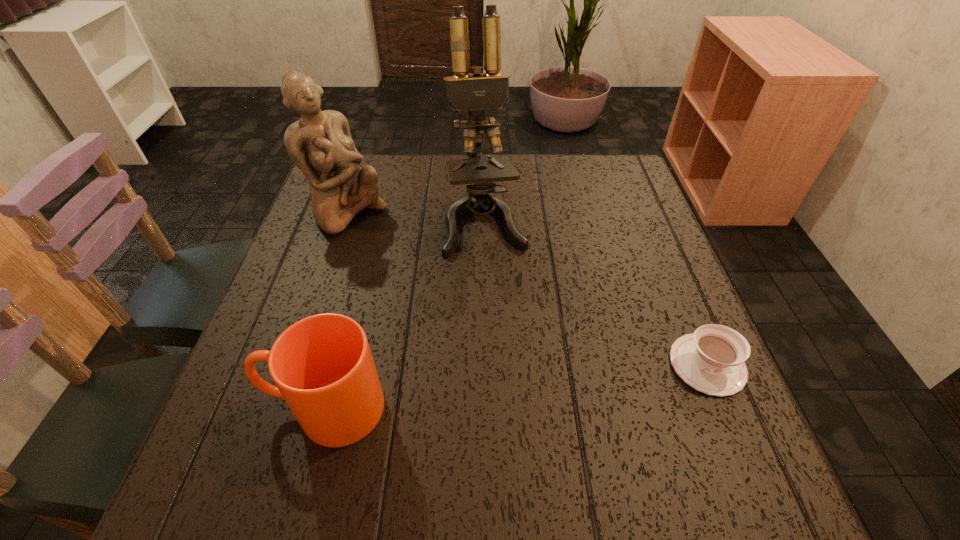
Locate an element on the screen. object that is at the near left corner is located at coordinates (322, 365).

Identify the location of object situated at the near right corner. This screenshot has height=540, width=960. (711, 360).

At what (x,y) coordinates should I click in order to perform the action: click on free space at the far edge of the desktop. Please return your answer as a coordinate pair (x, y). Looking at the image, I should click on (444, 201).

This screenshot has height=540, width=960. I want to click on vacant position at the near edge of the desktop, so click(520, 436).

Find the location of a particular element. The height and width of the screenshot is (540, 960). vacant space at the left edge of the desktop is located at coordinates (271, 332).

At what (x,y) coordinates should I click in order to perform the action: click on vacant space at the right edge of the desktop. Please return your answer as a coordinate pair (x, y). This screenshot has width=960, height=540. Looking at the image, I should click on (593, 214).

Where is `vacant area at the near right corner of the desktop`? The image size is (960, 540). vacant area at the near right corner of the desktop is located at coordinates (679, 407).

Where is `free space between the figurine and the tallest object`? This screenshot has width=960, height=540. free space between the figurine and the tallest object is located at coordinates pyautogui.click(x=417, y=218).

What are the coordinates of `free space that is in between the rightmost object and the mug` in the screenshot? It's located at (516, 387).

Locate an element on the screen. Image resolution: width=960 pixels, height=540 pixels. free space between the second shortest object and the microscope is located at coordinates (405, 315).